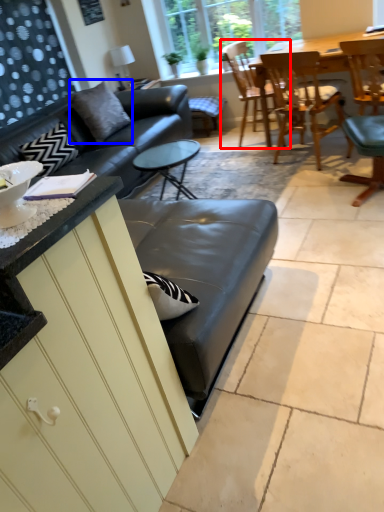
Question: Which of the following is the farthest to the observer, chair (highlighted by a red box) or pillow (highlighted by a blue box)?

Choices:
 (A) chair
 (B) pillow

Answer: (A)